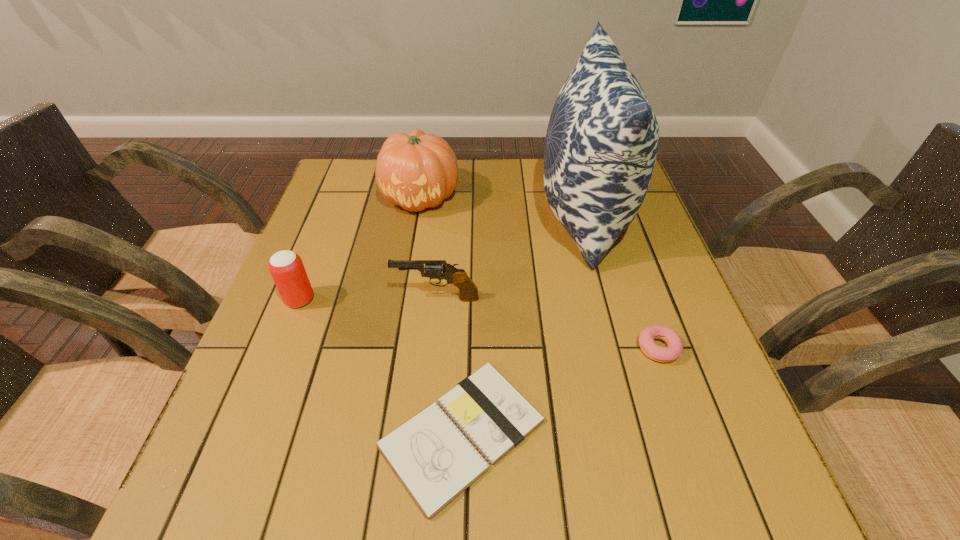
Identify which object is the second closest to the fifth tallest object. Please provide its 2D coordinates. Your answer should be formatted as a tuple, i.e. [(x, y)], where the tuple contains the x and y coordinates of a point satisfying the conditions above.

[(435, 462)]

Select which object is the fifth closest to the tallest object. Please provide its 2D coordinates. Your answer should be formatted as a tuple, i.e. [(x, y)], where the tuple contains the x and y coordinates of a point satisfying the conditions above.

[(286, 267)]

In order to click on free space that satisfies the following two spatial constraints: 1. along the barrel of the gun; 2. on the carved face of the pumpkin in this screenshot , I will do `click(446, 197)`.

This screenshot has height=540, width=960. Find the location of `vacant area that satisfies the following two spatial constraints: 1. on the back side of the doughnut; 2. on the front surface of the cushion`. vacant area that satisfies the following two spatial constraints: 1. on the back side of the doughnut; 2. on the front surface of the cushion is located at coordinates (612, 215).

Where is `vacant point that satisfies the following two spatial constraints: 1. on the carved face of the pumpkin; 2. along the barrel of the gun`? vacant point that satisfies the following two spatial constraints: 1. on the carved face of the pumpkin; 2. along the barrel of the gun is located at coordinates (403, 299).